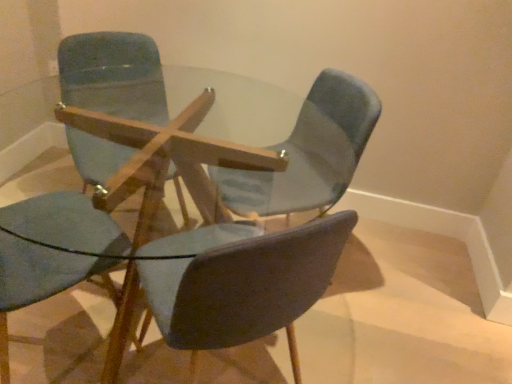
Question: Is light blue fabric chair at center, which is the first chair from right to left, a part of matte blue chair at upper left, the 3th chair positioned from the right?

Choices:
 (A) no
 (B) yes

Answer: (A)

Question: Is matte blue chair at upper left, the 3th chair positioned from the right, oriented away from light blue fabric chair at center, marked as the fourth chair in a left-to-right arrangement?

Choices:
 (A) yes
 (B) no

Answer: (B)

Question: Does matte blue chair at upper left, the 3th chair positioned from the right, appear on the left side of light blue fabric chair at center, which is the first chair from right to left?

Choices:
 (A) no
 (B) yes

Answer: (B)

Question: From the image's perspective, is matte blue chair at upper left, marked as the 2th chair in a left-to-right arrangement, located above light blue fabric chair at center, marked as the fourth chair in a left-to-right arrangement?

Choices:
 (A) yes
 (B) no

Answer: (A)

Question: From the image's perspective, is matte blue chair at upper left, the 3th chair positioned from the right, beneath light blue fabric chair at center, which is the first chair from right to left?

Choices:
 (A) yes
 (B) no

Answer: (B)

Question: From a real-world perspective, is matte blue chair at upper left, marked as the 2th chair in a left-to-right arrangement, on light blue fabric chair at center, which is the first chair from right to left?

Choices:
 (A) no
 (B) yes

Answer: (B)

Question: From the image's perspective, is matte blue chair at center, which is counted as the 3th chair, starting from the left, located beneath matte blue chair at upper left, the fourth chair viewed from the right?

Choices:
 (A) no
 (B) yes

Answer: (B)

Question: Considering the relative sizes of matte blue chair at center, which is counted as the 3th chair, starting from the left, and matte blue chair at upper left, the first chair viewed from the left, in the image provided, is matte blue chair at center, which is counted as the 3th chair, starting from the left, taller than matte blue chair at upper left, the first chair viewed from the left,?

Choices:
 (A) no
 (B) yes

Answer: (A)

Question: Considering the relative sizes of matte blue chair at center, which is counted as the 3th chair, starting from the left, and matte blue chair at upper left, the fourth chair viewed from the right, in the image provided, is matte blue chair at center, which is counted as the 3th chair, starting from the left, bigger than matte blue chair at upper left, the fourth chair viewed from the right,?

Choices:
 (A) yes
 (B) no

Answer: (A)

Question: Is matte blue chair at center, which is counted as the 3th chair, starting from the left, smaller than matte blue chair at upper left, the first chair viewed from the left?

Choices:
 (A) yes
 (B) no

Answer: (B)

Question: Does matte blue chair at center, which is the second chair in right-to-left order, come behind matte blue chair at upper left, the first chair viewed from the left?

Choices:
 (A) yes
 (B) no

Answer: (B)

Question: Could you tell me if matte blue chair at center, which is counted as the 3th chair, starting from the left, is facing matte blue chair at upper left, the fourth chair viewed from the right?

Choices:
 (A) yes
 (B) no

Answer: (B)

Question: Is matte blue chair at upper left, marked as the 2th chair in a left-to-right arrangement, to the right of matte blue chair at center, which is the second chair in right-to-left order, from the viewer's perspective?

Choices:
 (A) yes
 (B) no

Answer: (B)